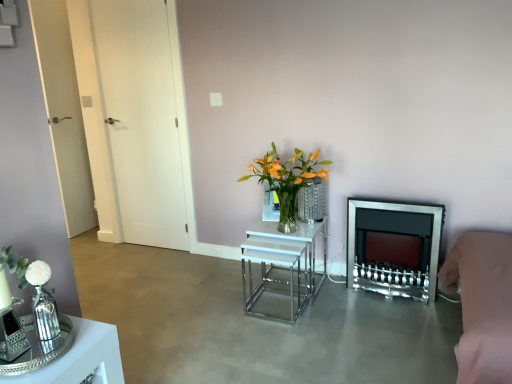
Question: Does clear glass vase at center have a greater width compared to shiny silver tray at lower left, the first table positioned from the front?

Choices:
 (A) yes
 (B) no

Answer: (B)

Question: Is clear glass vase at center located outside shiny silver tray at lower left, the second table in the back-to-front sequence?

Choices:
 (A) no
 (B) yes

Answer: (B)

Question: Does clear glass vase at center appear on the left side of shiny silver tray at lower left, the second table in the back-to-front sequence?

Choices:
 (A) yes
 (B) no

Answer: (B)

Question: Is clear glass vase at center beside shiny silver tray at lower left, the second table from the right?

Choices:
 (A) no
 (B) yes

Answer: (A)

Question: Is clear glass vase at center looking in the opposite direction of shiny silver tray at lower left, the second table in the back-to-front sequence?

Choices:
 (A) yes
 (B) no

Answer: (B)

Question: Would you say smooth concrete floor at center is to the left or to the right of shiny silver tray at lower left, which ranks as the 1th table in left-to-right order, in the picture?

Choices:
 (A) left
 (B) right

Answer: (B)

Question: From a real-world perspective, is smooth concrete floor at center physically located above or below shiny silver tray at lower left, which ranks as the 1th table in left-to-right order?

Choices:
 (A) below
 (B) above

Answer: (A)

Question: Is smooth concrete floor at center inside the boundaries of shiny silver tray at lower left, the second table from the right, or outside?

Choices:
 (A) inside
 (B) outside

Answer: (B)

Question: Is smooth concrete floor at center bigger or smaller than shiny silver tray at lower left, the second table in the back-to-front sequence?

Choices:
 (A) big
 (B) small

Answer: (A)

Question: In terms of width, does translucent glass vase at center look wider or thinner when compared to white matte square at upper center?

Choices:
 (A) thin
 (B) wide

Answer: (B)

Question: Considering the relative positions of translucent glass vase at center and white matte square at upper center in the image provided, is translucent glass vase at center to the left or to the right of white matte square at upper center?

Choices:
 (A) right
 (B) left

Answer: (A)

Question: Is translucent glass vase at center bigger or smaller than white matte square at upper center?

Choices:
 (A) big
 (B) small

Answer: (A)

Question: Considering the positions of point (264, 175) and point (221, 100), is point (264, 175) closer or farther from the camera than point (221, 100)?

Choices:
 (A) closer
 (B) farther

Answer: (A)

Question: Does point (302, 160) appear closer or farther from the camera than point (302, 233)?

Choices:
 (A) farther
 (B) closer

Answer: (A)

Question: From a real-world perspective, relative to white glossy nesting tables at center, the first table viewed from the back, is translucent glass vase at center vertically above or below?

Choices:
 (A) above
 (B) below

Answer: (A)